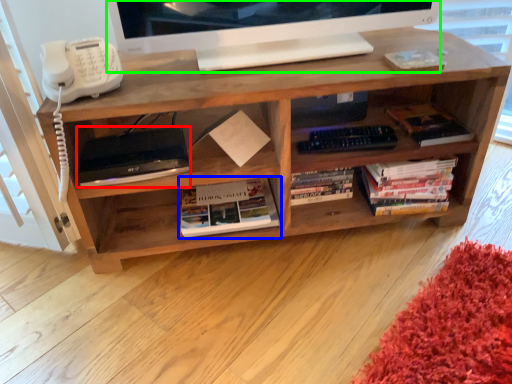
Question: Estimate the real-world distances between objects in this image. Which object is closer to equipment (highlighted by a red box), book (highlighted by a blue box) or television (highlighted by a green box)?

Choices:
 (A) book
 (B) television

Answer: (A)